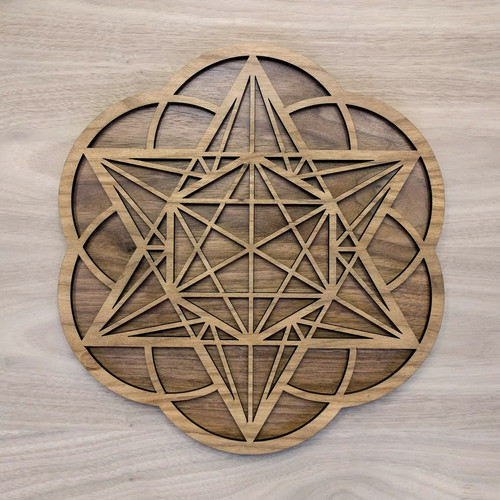
Where is `wood design`? The height and width of the screenshot is (500, 500). wood design is located at coordinates (252, 250).